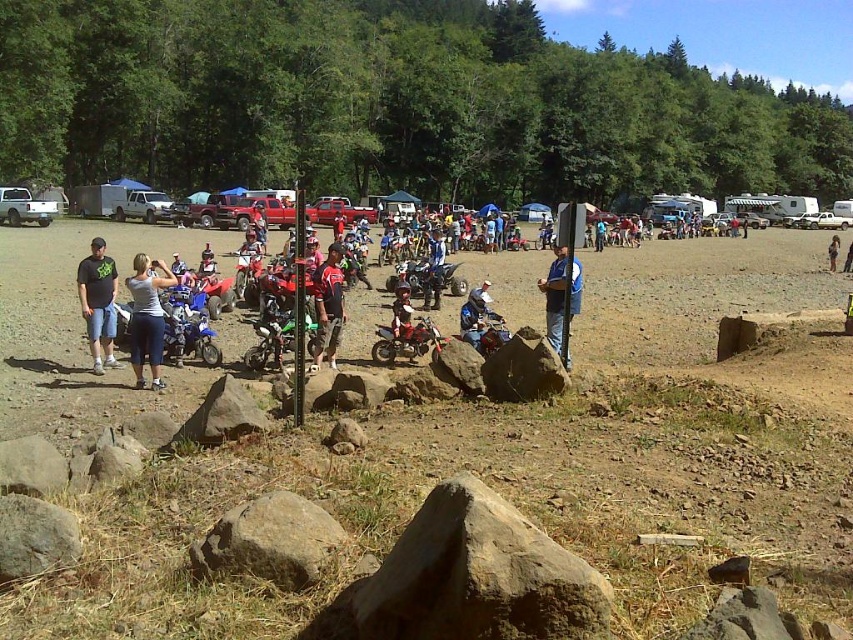
Question: Which object appears farthest from the camera in this image?

Choices:
 (A) matte black dirt bike at center
 (B) blue metallic motorcycle at center
 (C) gray rough rock at center

Answer: (A)

Question: From the image, what is the correct spatial relationship of dark gray t-shirt at left in relation to matte red dirt bike at center?

Choices:
 (A) left
 (B) right

Answer: (A)

Question: From the image, what is the correct spatial relationship of reddish-brown leather jacket at center in relation to matte black motorcycle at center?

Choices:
 (A) below
 (B) above

Answer: (A)

Question: Which object is positioned farthest from the gray fabric shirt at center?

Choices:
 (A) blue denim jeans at center
 (B) gray rough rock at center
 (C) denim jacket at center

Answer: (C)

Question: Which point is farther to the camera?

Choices:
 (A) dark gray t-shirt at left
 (B) blue metallic motorcycle at center
 (C) matte red dirt bike at center
 (D) blue denim jeans at center

Answer: (C)

Question: Is the position of gray rough rock at center more distant than that of green matte dirt bike at center?

Choices:
 (A) yes
 (B) no

Answer: (B)